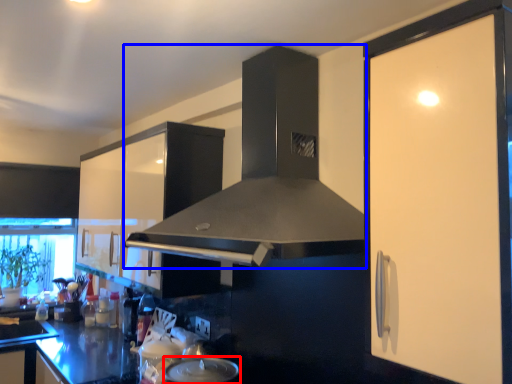
Question: Which object is closer to the camera taking this photo, kitchen appliance (highlighted by a red box) or home appliance (highlighted by a blue box)?

Choices:
 (A) kitchen appliance
 (B) home appliance

Answer: (B)